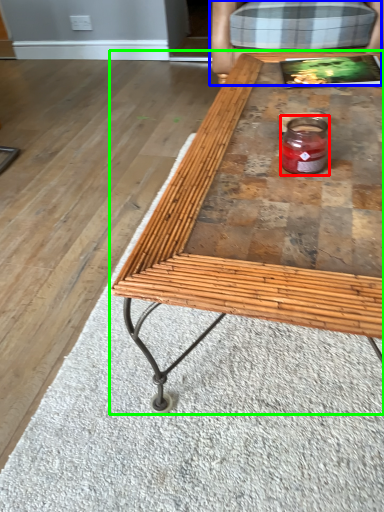
Question: Based on their relative distances, which object is nearer to glass jar (highlighted by a red box)? Choose from armchair (highlighted by a blue box) and coffee table (highlighted by a green box).

Choices:
 (A) armchair
 (B) coffee table

Answer: (B)